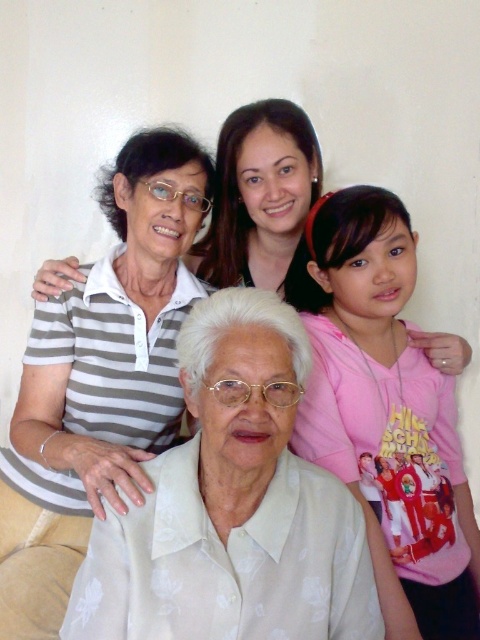
Can you confirm if gray striped shirt at upper left is positioned above pink cotton shirt at upper right?

Indeed, gray striped shirt at upper left is positioned over pink cotton shirt at upper right.

Between point (56, 385) and point (385, 227), which one is positioned behind?

The point (56, 385) is more distant.

This screenshot has height=640, width=480. In order to click on gray striped shirt at upper left in this screenshot , I will do `click(99, 380)`.